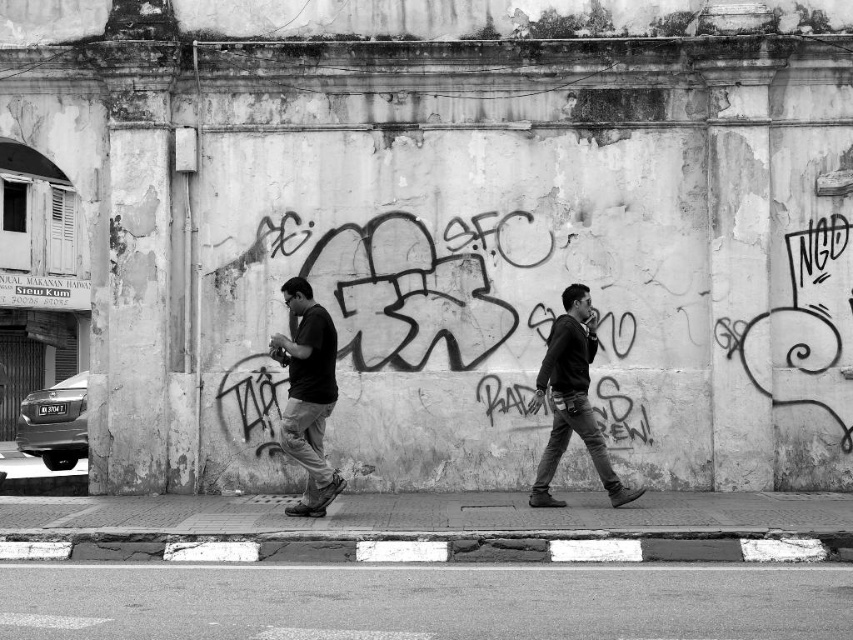
Question: Is matte black shirt at center wider than dark gray hoodie at center?

Choices:
 (A) yes
 (B) no

Answer: (B)

Question: Is matte black shirt at center to the left of dark gray hoodie at center from the viewer's perspective?

Choices:
 (A) no
 (B) yes

Answer: (B)

Question: Can you confirm if matte black shirt at center is positioned above dark gray hoodie at center?

Choices:
 (A) no
 (B) yes

Answer: (B)

Question: Which object appears farthest from the camera in this image?

Choices:
 (A) matte black shirt at center
 (B) dark gray hoodie at center

Answer: (B)

Question: Which of the following is the closest to the observer?

Choices:
 (A) (320, 365)
 (B) (572, 301)

Answer: (A)